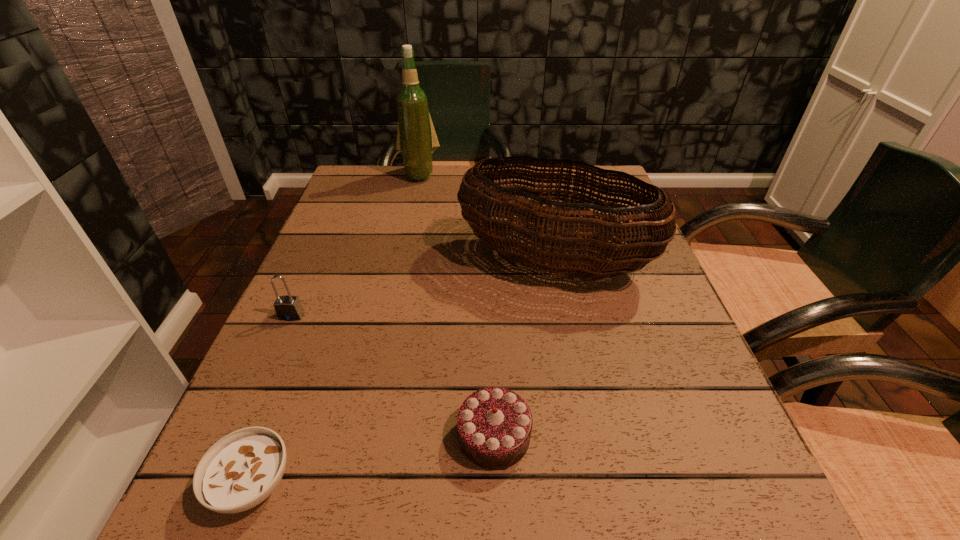
Where is `the third object from left to right`? The height and width of the screenshot is (540, 960). the third object from left to right is located at coordinates (416, 138).

Locate an element on the screen. The width and height of the screenshot is (960, 540). the tallest object is located at coordinates click(416, 138).

This screenshot has width=960, height=540. In order to click on the second farthest object in this screenshot , I will do `click(563, 252)`.

Where is `the fourth shortest object`? Image resolution: width=960 pixels, height=540 pixels. the fourth shortest object is located at coordinates (563, 252).

Find the location of `the third tallest object`. the third tallest object is located at coordinates (287, 308).

Locate an element on the screen. the third farthest object is located at coordinates (287, 308).

Where is `chocolate cake`? The height and width of the screenshot is (540, 960). chocolate cake is located at coordinates (494, 424).

Locate an element on the screen. This screenshot has width=960, height=540. soup bowl is located at coordinates (242, 469).

At what (x,y) coordinates should I click in order to perform the action: click on vacant space situated 0.200m on the front-facing side of the tallest object. Please return your answer as a coordinate pair (x, y). Image resolution: width=960 pixels, height=540 pixels. Looking at the image, I should click on (409, 225).

I want to click on vacant space situated 0.120m on the front of the second tallest object, so 571,348.